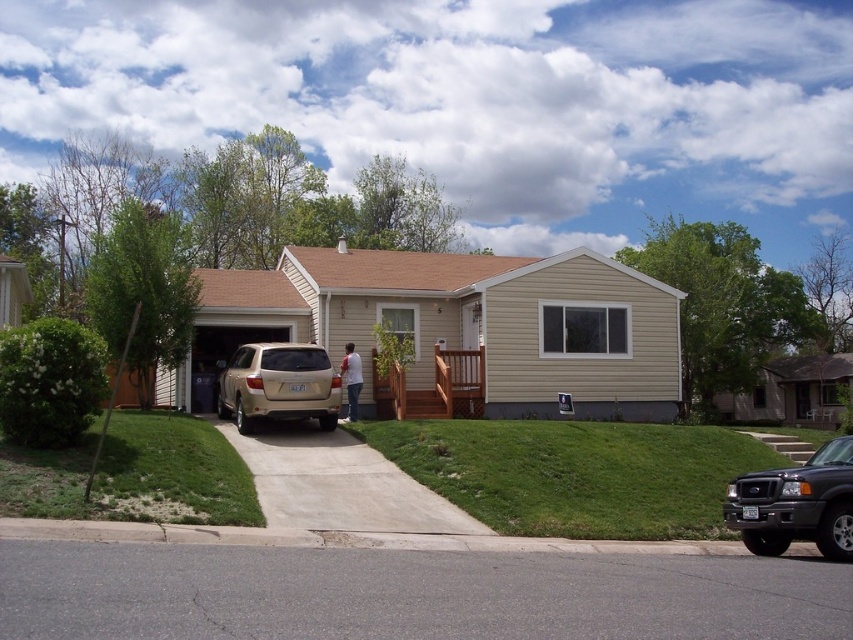
Question: Considering the real-world distances, which object is farthest from the asphalt at lower center?

Choices:
 (A) concrete at center
 (B) shiny black suv at lower right
 (C) gold metallic suv at center

Answer: (C)

Question: Is shiny black suv at lower right smaller than gold metallic suv at center?

Choices:
 (A) no
 (B) yes

Answer: (B)

Question: From the image, what is the correct spatial relationship of shiny black suv at lower right in relation to gold metallic suv at center?

Choices:
 (A) left
 (B) right

Answer: (B)

Question: Which point is farther from the camera taking this photo?

Choices:
 (A) (508, 604)
 (B) (830, 538)
 (C) (317, 365)
 (D) (273, 515)

Answer: (C)

Question: Can you confirm if asphalt at lower center is positioned to the right of gold metallic suv at center?

Choices:
 (A) no
 (B) yes

Answer: (B)

Question: Which of the following is the closest to the observer?

Choices:
 (A) (x=328, y=381)
 (B) (x=280, y=461)
 (C) (x=115, y=564)

Answer: (C)